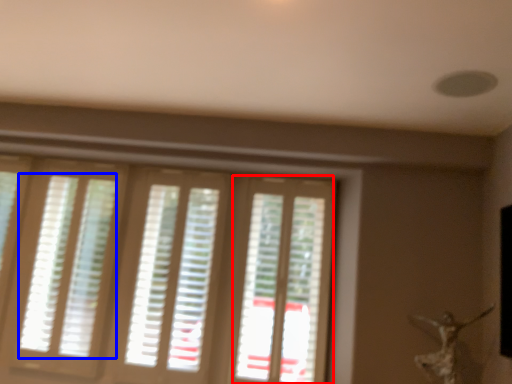
Question: Which object is further to the camera taking this photo, screen door (highlighted by a red box) or blind (highlighted by a blue box)?

Choices:
 (A) screen door
 (B) blind

Answer: (B)